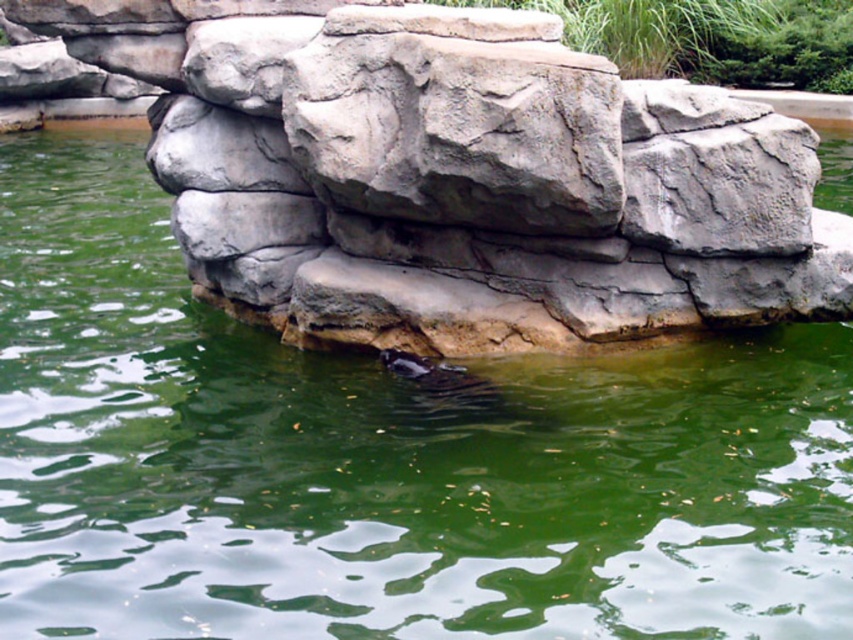
You are a photographer trying to capture the gray rough rock at center and the shiny brown otter at center in the same frame. Which object should you focus on first if you want to ensure both are in focus, considering their sizes?

The gray rough rock at center has a larger size compared to the shiny brown otter at center, so focusing on the gray rough rock at center first would help ensure both are in focus as it occupies more space in the frame.

You are a landscape architect designing a pond and need to place two rocks in the center. The gray stone rock at center and the gray rough rock at center must be positioned such that their widths do not exceed the pond width of 2 meters. Given their widths, can both rocks fit side by side in the pond?

The gray stone rock at center is wider than the gray rough rock at center. If the combined width of both rocks exceeds 2 meters, they cannot fit side by side. However, without specific measurements, it is impossible to determine definitively.

You are a landscape architect designing a garden and want to place both the gray stone rock at center and the gray rough rock at center in a pond. Which rock should you place at the bottom of the pond to ensure it remains stable and doesn not float away?

The gray stone rock at center has a greater height compared to the gray rough rock at center, so placing the taller gray stone rock at center at the bottom of the pond would provide better stability due to its increased mass and lower center of gravity.